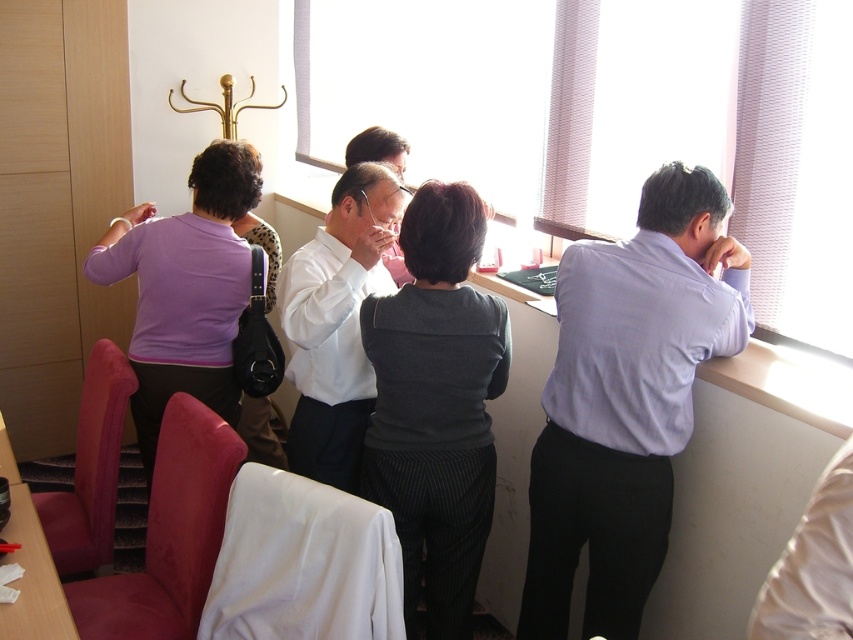
Between point (811, 310) and point (575, 364), which one is positioned in front?

Point (811, 310) is more forward.

Is point (515, 186) positioned after point (703, 228)?

Yes, it is.

Is point (405, 116) closer to camera compared to point (714, 316)?

That is False.

This screenshot has height=640, width=853. Identify the location of transparent glass window at upper center. (714, 132).

Which of these two, transparent glass window at upper center or white glossy shirt at center, stands taller?

Standing taller between the two is transparent glass window at upper center.

Is transparent glass window at upper center to the right of white glossy shirt at center from the viewer's perspective?

Yes, transparent glass window at upper center is to the right of white glossy shirt at center.

Between point (795, 152) and point (314, 400), which one is positioned in front?

Point (795, 152)

The image size is (853, 640). I want to click on transparent glass window at upper center, so (714, 132).

Is transparent glass window at upper center to the right of dark gray textured sweater at center from the viewer's perspective?

Yes, transparent glass window at upper center is to the right of dark gray textured sweater at center.

Is transparent glass window at upper center smaller than dark gray textured sweater at center?

Actually, transparent glass window at upper center might be larger than dark gray textured sweater at center.

Does point (329, 128) come farther from viewer compared to point (407, 513)?

Yes, it is.

Where is `transparent glass window at upper center`? The width and height of the screenshot is (853, 640). transparent glass window at upper center is located at coordinates (714, 132).